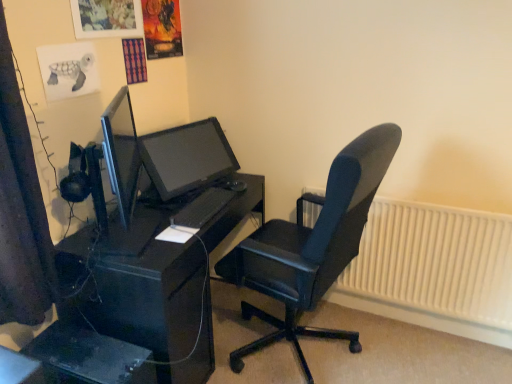
The width and height of the screenshot is (512, 384). In order to click on vacant space underneath black leather office chair at center (from a real-world perspective) in this screenshot , I will do `click(309, 347)`.